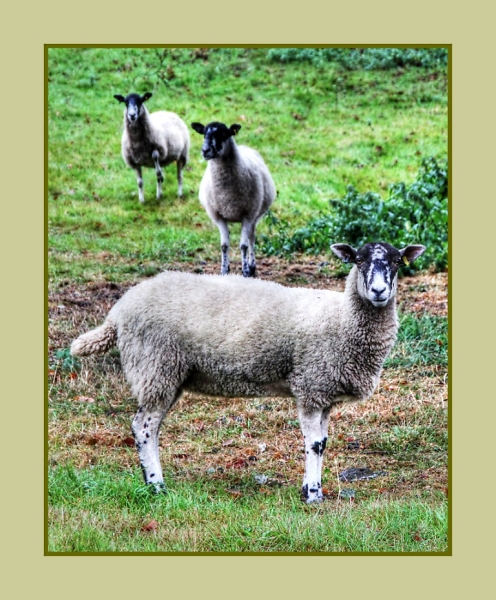
You are a GUI agent. You are given a task and a screenshot of the screen. Output one action in this format:
    pyautogui.click(x=<x>, y=<y>)
    Task: Click on the picture
    The height and width of the screenshot is (600, 496).
    Given the screenshot: What is the action you would take?
    pyautogui.click(x=220, y=218)